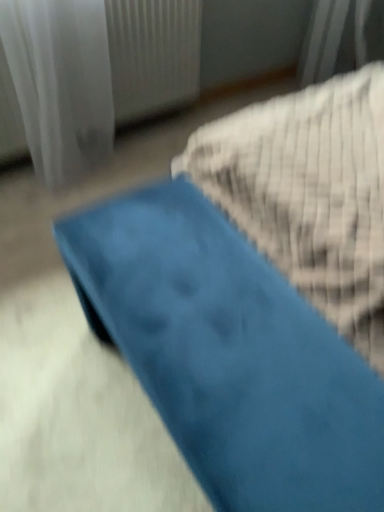
Where is `vacant point to the left of blue fabric ottoman at center`? vacant point to the left of blue fabric ottoman at center is located at coordinates (52, 365).